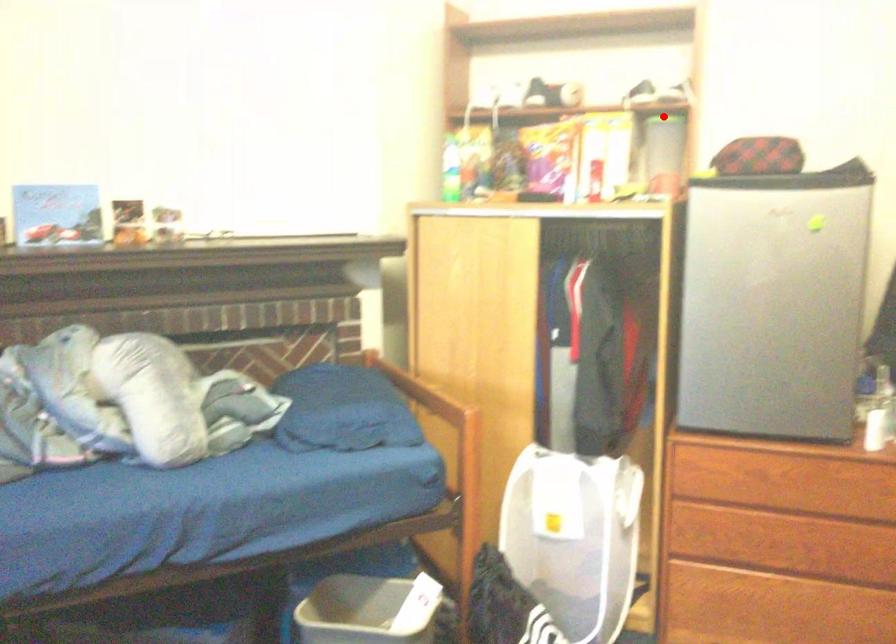
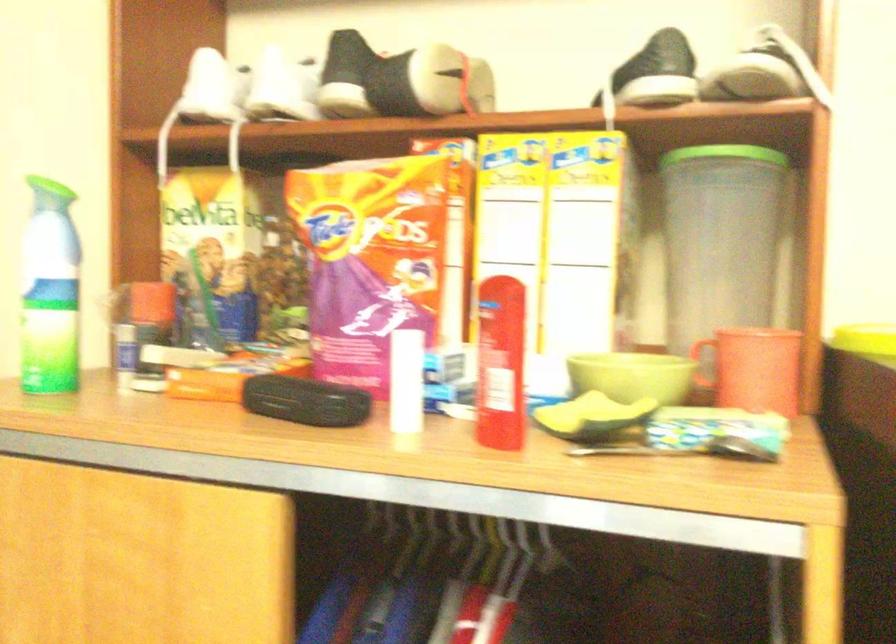
The point at the highlighted location is marked in the first image. Where is the corresponding point in the second image?

(725, 153)